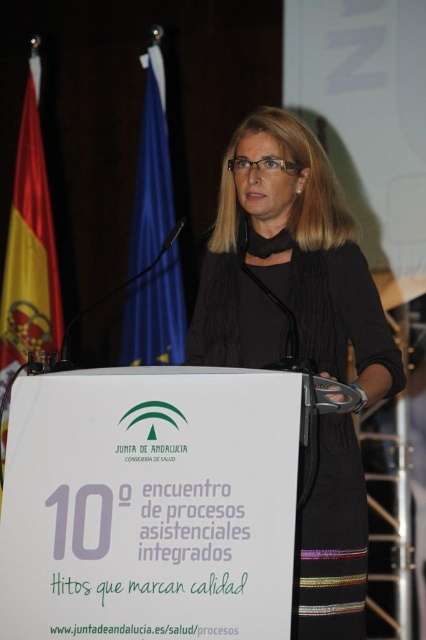
Consider the image. You are a guest at this event and want to take a photo with the blue fabric flag at upper left and red fabric flag at left. Which flag should you stand to the right of to have both flags in the frame?

You should stand to the right of the red fabric flag at left because the blue fabric flag at upper left is positioned on the right side of the red fabric flag at left, so standing to the right of the red flag will include both flags in the photo.